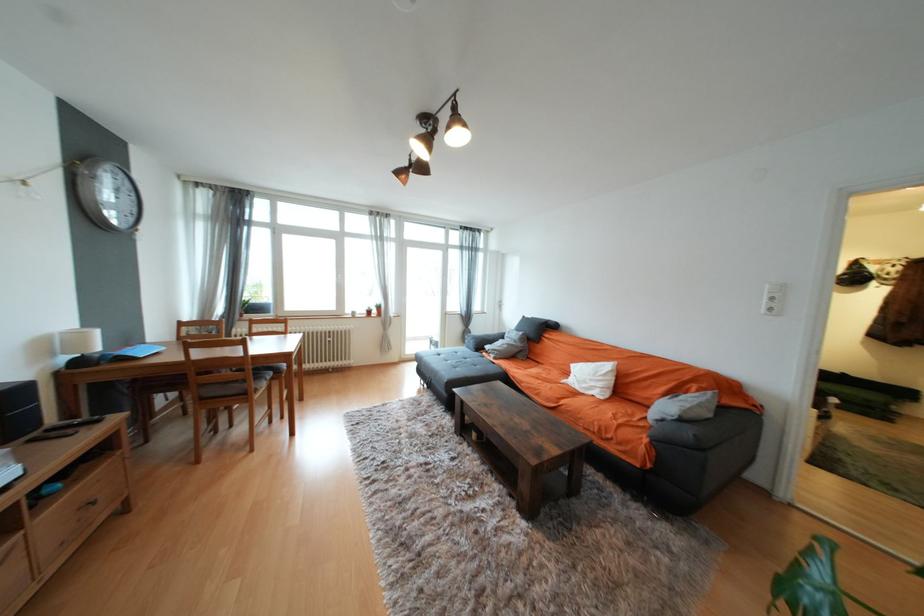
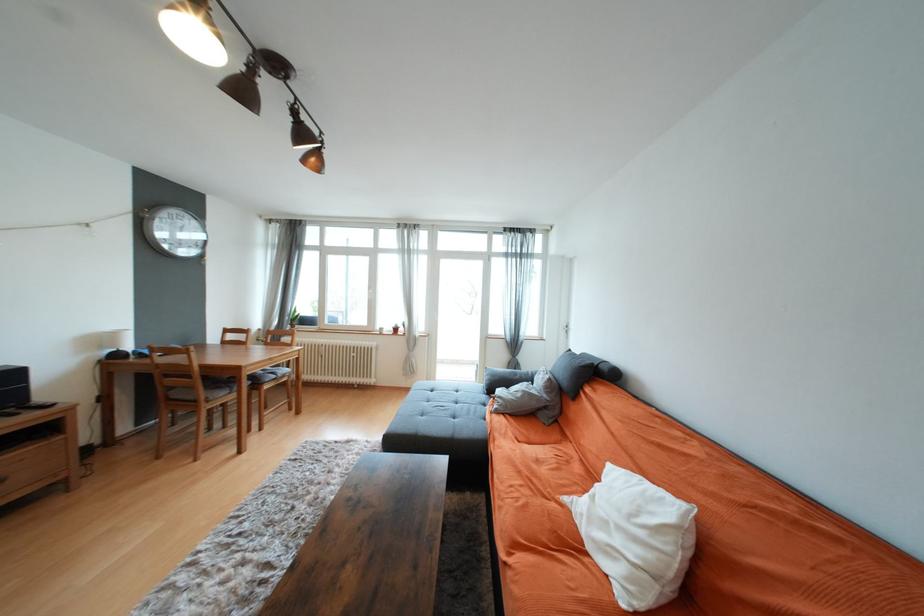
Find the pixel in the second image that matches (100,504) in the first image.

(7, 482)